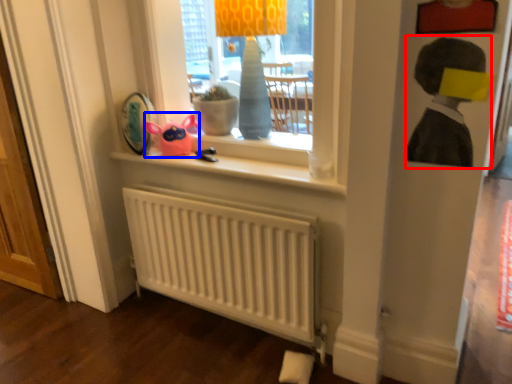
Question: Which point is closer to the camera, person (highlighted by a red box) or toy (highlighted by a blue box)?

Choices:
 (A) person
 (B) toy

Answer: (A)